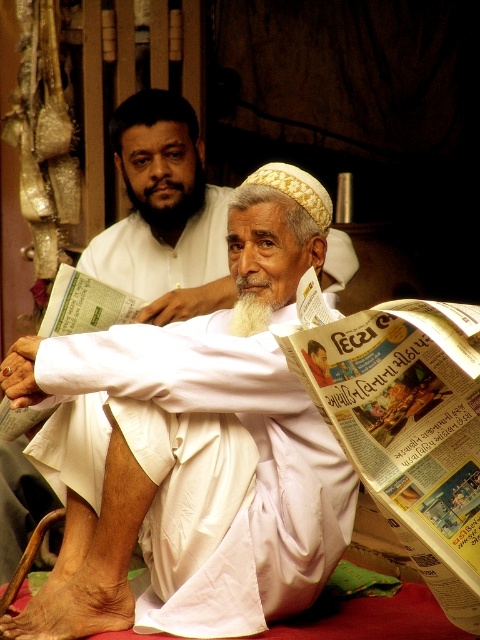
Is black beard at upper center to the right of white soft beard at center from the viewer's perspective?

No, black beard at upper center is not to the right of white soft beard at center.

Is black beard at upper center to the left of white soft beard at center from the viewer's perspective?

Yes, black beard at upper center is to the left of white soft beard at center.

From the picture: Who is more forward, (146, 204) or (266, 304)?

Positioned in front is point (266, 304).

I want to click on black beard at upper center, so click(169, 205).

Is white clothed man at center above white soft beard at center?

Actually, white clothed man at center is below white soft beard at center.

Is white clothed man at center below white soft beard at center?

Indeed, white clothed man at center is positioned under white soft beard at center.

Between point (240, 230) and point (244, 317), which one is positioned behind?

Point (240, 230)

You are a GUI agent. You are given a task and a screenshot of the screen. Output one action in this format:
    pyautogui.click(x=<x>, y=<y>)
    Task: Click on the white clothed man at center
    The image size is (480, 640).
    Given the screenshot: What is the action you would take?
    pyautogui.click(x=180, y=481)

Is white clothed man at center further to camera compared to black beard at upper center?

No, white clothed man at center is in front of black beard at upper center.

Who is more forward, (136, 412) or (130, 182)?

Point (136, 412) is more forward.

Is point (186, 429) farther from viewer compared to point (187, 205)?

That is False.

Identify the location of white clothed man at center. This screenshot has width=480, height=640. (180, 481).